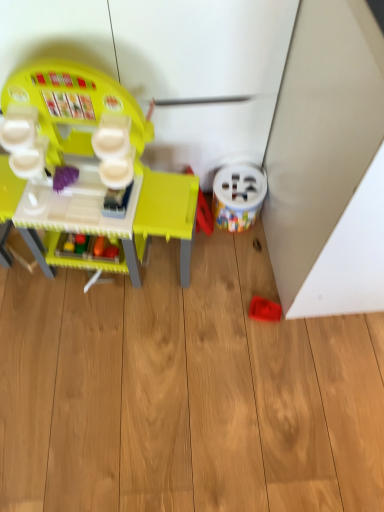
Question: From the image's perspective, does white plastic bucket at lower right, the 2th toy when ordered from left to right, appear lower than matte plastic play kitchen at left, placed as the first toy when sorted from left to right?

Choices:
 (A) no
 (B) yes

Answer: (A)

Question: Is white plastic bucket at lower right, the second toy viewed from the right, to the right of matte plastic play kitchen at left, positioned as the third toy in right-to-left order, from the viewer's perspective?

Choices:
 (A) no
 (B) yes

Answer: (B)

Question: Can you confirm if white plastic bucket at lower right, the second toy viewed from the right, is thinner than matte plastic play kitchen at left, placed as the first toy when sorted from left to right?

Choices:
 (A) no
 (B) yes

Answer: (B)

Question: Are white plastic bucket at lower right, the 2th toy when ordered from left to right, and matte plastic play kitchen at left, positioned as the third toy in right-to-left order, beside each other?

Choices:
 (A) no
 (B) yes

Answer: (A)

Question: Does white plastic bucket at lower right, the 2th toy when ordered from left to right, have a greater height compared to matte plastic play kitchen at left, placed as the first toy when sorted from left to right?

Choices:
 (A) yes
 (B) no

Answer: (B)

Question: Does point (54, 199) appear closer or farther from the camera than point (269, 313)?

Choices:
 (A) farther
 (B) closer

Answer: (B)

Question: Would you say matte plastic play kitchen at left, placed as the first toy when sorted from left to right, is inside or outside rubberized red toy at lower right, which appears as the 1th toy when viewed from the right?

Choices:
 (A) outside
 (B) inside

Answer: (A)

Question: Is matte plastic play kitchen at left, positioned as the third toy in right-to-left order, bigger or smaller than rubberized red toy at lower right, which appears as the 1th toy when viewed from the right?

Choices:
 (A) small
 (B) big

Answer: (B)

Question: Looking at their shapes, would you say matte plastic play kitchen at left, placed as the first toy when sorted from left to right, is wider or thinner than rubberized red toy at lower right, which appears as the 1th toy when viewed from the right?

Choices:
 (A) thin
 (B) wide

Answer: (B)

Question: From the image's perspective, is matte plastic play kitchen at left, positioned as the third toy in right-to-left order, positioned above or below white plastic bucket at lower right, the second toy viewed from the right?

Choices:
 (A) above
 (B) below

Answer: (B)

Question: From a real-world perspective, is matte plastic play kitchen at left, placed as the first toy when sorted from left to right, above or below white plastic bucket at lower right, the second toy viewed from the right?

Choices:
 (A) below
 (B) above

Answer: (B)

Question: Considering the relative positions of matte plastic play kitchen at left, positioned as the third toy in right-to-left order, and white plastic bucket at lower right, the 2th toy when ordered from left to right, in the image provided, is matte plastic play kitchen at left, positioned as the third toy in right-to-left order, to the left or to the right of white plastic bucket at lower right, the 2th toy when ordered from left to right,?

Choices:
 (A) left
 (B) right

Answer: (A)

Question: Is matte plastic play kitchen at left, placed as the first toy when sorted from left to right, taller or shorter than white plastic bucket at lower right, the second toy viewed from the right?

Choices:
 (A) tall
 (B) short

Answer: (A)

Question: Considering the positions of rubberized red toy at lower right, which appears as the 1th toy when viewed from the right, and matte plastic play kitchen at left, placed as the first toy when sorted from left to right, in the image, is rubberized red toy at lower right, which appears as the 1th toy when viewed from the right, taller or shorter than matte plastic play kitchen at left, placed as the first toy when sorted from left to right,?

Choices:
 (A) tall
 (B) short

Answer: (B)

Question: Choose the correct answer: Is rubberized red toy at lower right, the 3th toy from the left, inside matte plastic play kitchen at left, placed as the first toy when sorted from left to right, or outside it?

Choices:
 (A) inside
 (B) outside

Answer: (B)